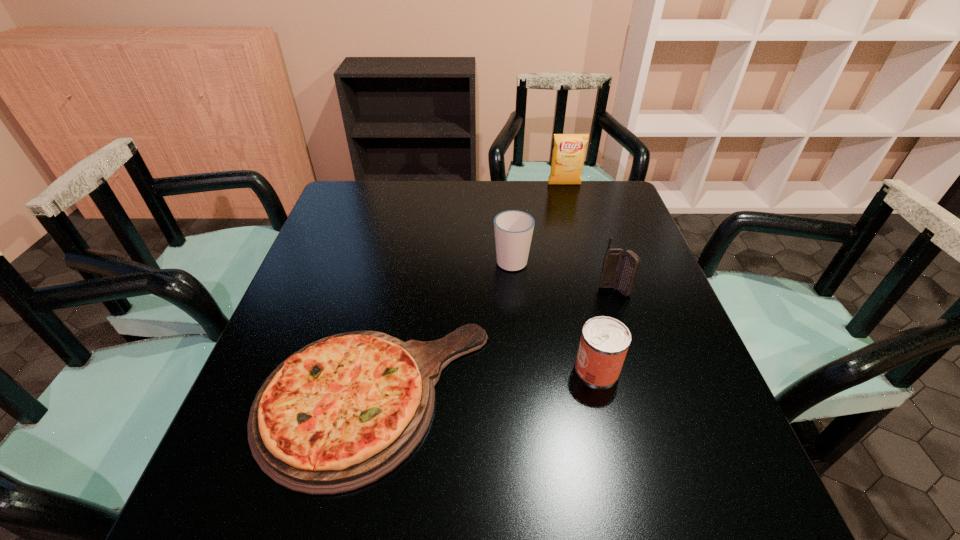
Find the location of `crisp (potato chip)`. crisp (potato chip) is located at coordinates (568, 154).

You are a GUI agent. You are given a task and a screenshot of the screen. Output one action in this format:
    pyautogui.click(x=<x>, y=<y>)
    Task: Click on the third nearest object
    
    Given the screenshot: What is the action you would take?
    pyautogui.click(x=619, y=269)

This screenshot has height=540, width=960. I want to click on the fourth nearest object, so click(x=513, y=229).

Locate an element on the screen. cup is located at coordinates (513, 229).

Locate an element on the screen. The image size is (960, 540). the fourth tallest object is located at coordinates (604, 343).

The height and width of the screenshot is (540, 960). Identify the location of pizza. (341, 413).

The width and height of the screenshot is (960, 540). I want to click on the leftmost object, so [x=341, y=413].

Image resolution: width=960 pixels, height=540 pixels. What are the coordinates of `free spot located on the front of the farthest object with the logo` in the screenshot? It's located at (567, 197).

Find the location of a particular element. The height and width of the screenshot is (540, 960). vacant space located 0.210m on the keyboard of the third farthest object is located at coordinates (639, 369).

The width and height of the screenshot is (960, 540). Find the location of `vacant region located with a handle on the side of the fourth object from right to left`. vacant region located with a handle on the side of the fourth object from right to left is located at coordinates (509, 221).